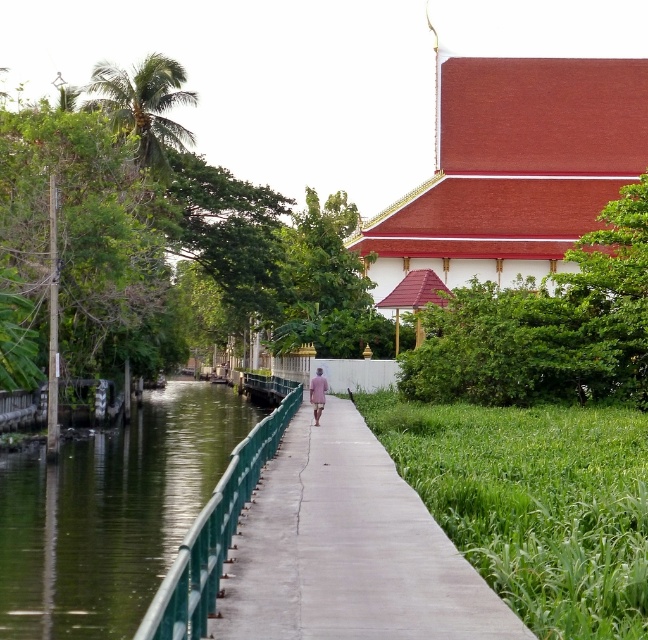
Does green metallic railing at lower left have a lesser height compared to green metal/rail at center?

Correct, green metallic railing at lower left is not as tall as green metal/rail at center.

Can you confirm if green metallic railing at lower left is smaller than green metal/rail at center?

Correct, green metallic railing at lower left occupies less space than green metal/rail at center.

Locate an element on the screen. green metallic railing at lower left is located at coordinates (110, 513).

Is green metal/rail at center positioned before pink fabric at center?

Yes, it is.

Which is behind, point (272, 438) or point (308, 390)?

The point (308, 390) is more distant.

Image resolution: width=648 pixels, height=640 pixels. I want to click on green metal/rail at center, so click(x=216, y=528).

Is green metallic railing at lower left in front of pink fabric at center?

Yes, it is.

Is green metallic railing at lower left wider than pink fabric at center?

Correct, the width of green metallic railing at lower left exceeds that of pink fabric at center.

Is point (211, 436) behind point (325, 396)?

Yes.

At what (x,y) coordinates should I click in order to perform the action: click on green metallic railing at lower left. Please return your answer as a coordinate pair (x, y). This screenshot has width=648, height=640. Looking at the image, I should click on (110, 513).